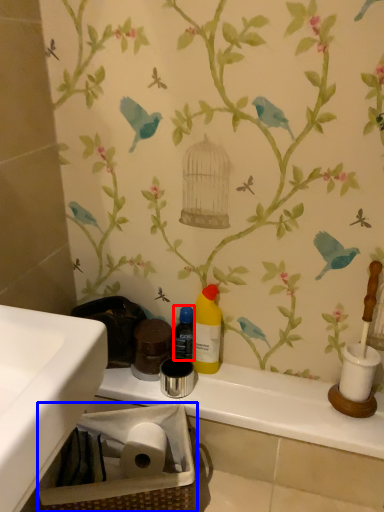
Question: Among these objects, which one is nearest to the camera, bottle (highlighted by a red box) or basket (highlighted by a blue box)?

Choices:
 (A) bottle
 (B) basket

Answer: (B)